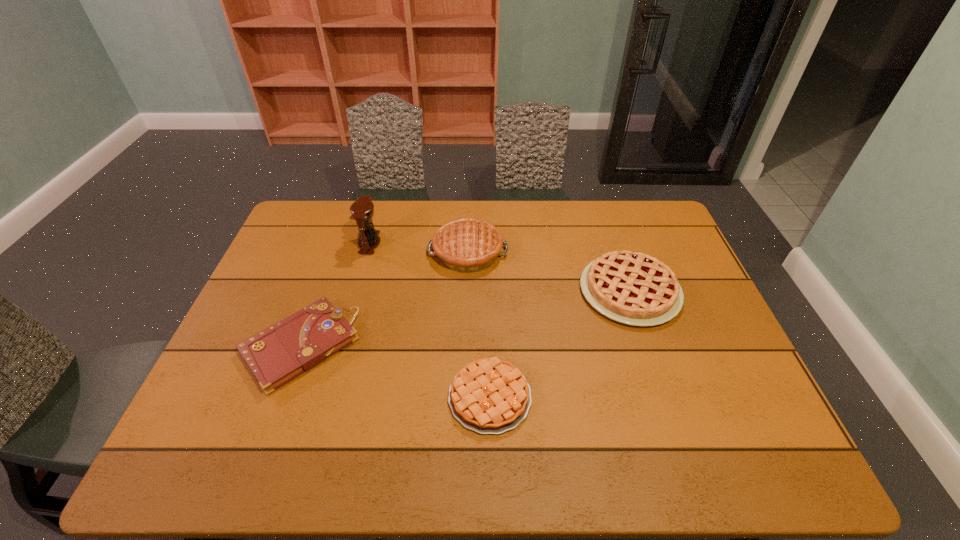
The width and height of the screenshot is (960, 540). Find the location of `the tallest object`. the tallest object is located at coordinates (362, 210).

The image size is (960, 540). Find the location of `the tallest pie`. the tallest pie is located at coordinates (466, 245).

The height and width of the screenshot is (540, 960). I want to click on the rightmost pie, so click(x=632, y=288).

Identify the location of the rightmost object. (632, 288).

Identify the location of notebook. The image size is (960, 540). (276, 355).

The width and height of the screenshot is (960, 540). I want to click on the nearest pie, so click(x=489, y=396).

You are a GUI agent. You are given a task and a screenshot of the screen. Output one action in this format:
    pyautogui.click(x=<x>, y=<y>)
    Task: Click on the vacant space located on the left of the hourglass
    
    Given the screenshot: What is the action you would take?
    pyautogui.click(x=302, y=243)

Identify the location of free space located 0.060m on the back of the second tallest object. The width and height of the screenshot is (960, 540). (468, 220).

In order to click on vacant space situated 0.350m on the front of the rightmost object in this screenshot , I will do `click(685, 455)`.

Where is `free spot located on the back of the notebook`? free spot located on the back of the notebook is located at coordinates (330, 262).